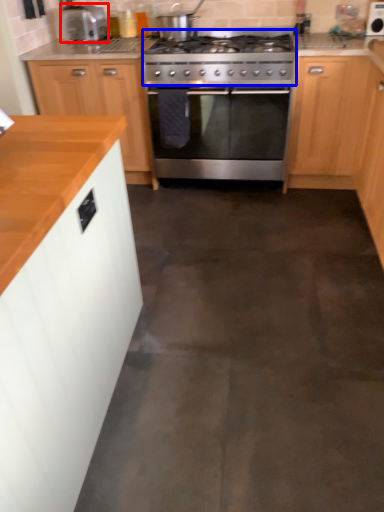
Question: Among these objects, which one is nearest to the camera, kitchen appliance (highlighted by a red box) or gas stove (highlighted by a blue box)?

Choices:
 (A) kitchen appliance
 (B) gas stove

Answer: (B)